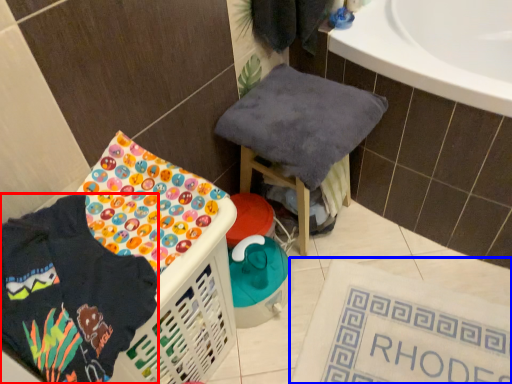
Question: Which object is closer to the camera taking this photo, clothing (highlighted by a red box) or bath mat (highlighted by a blue box)?

Choices:
 (A) clothing
 (B) bath mat

Answer: (A)